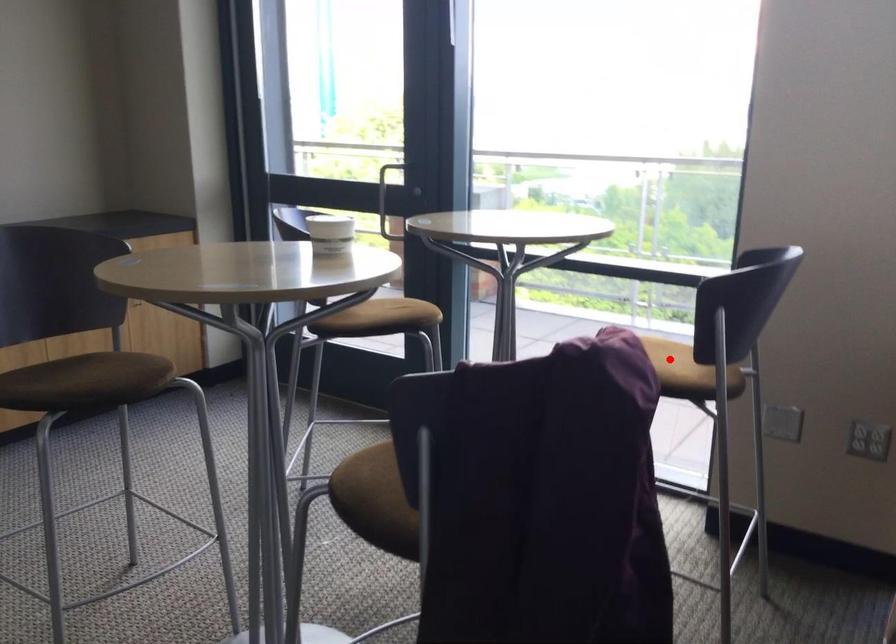
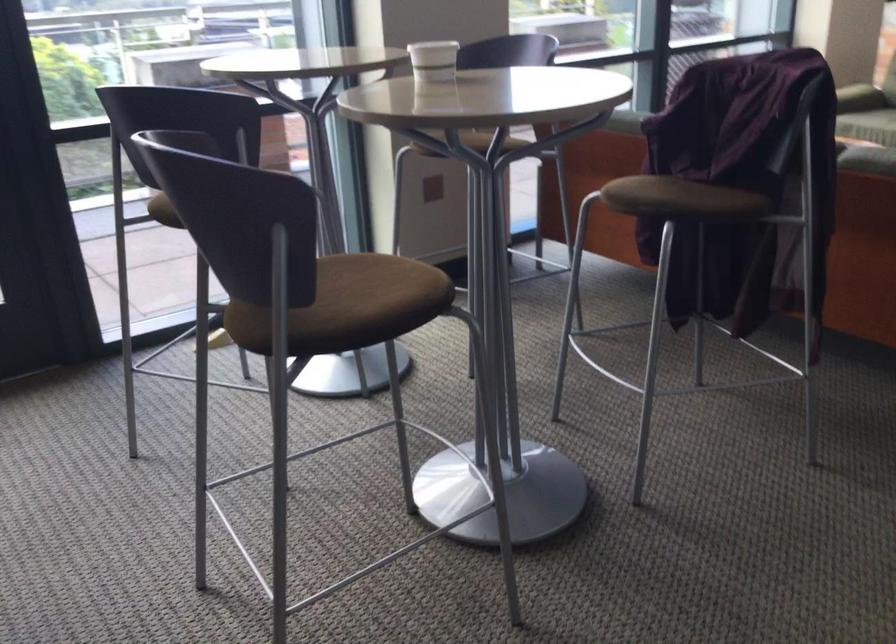
Question: I am providing you with two images of the same scene from different viewpoints. A red point is marked on the first image. Is the red point's position out of view in image 2?

Choices:
 (A) Yes
 (B) No

Answer: (A)